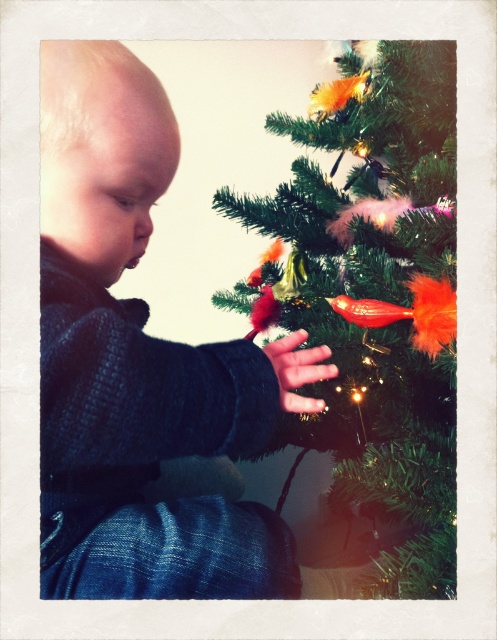
You are a photographer setting up a shot of the dark blue knitted sweater at left and the green matte christmas tree at center. Which object should you focus on first if you want to capture both in sharp focus?

The dark blue knitted sweater at left is closer to the viewer than the green matte christmas tree at center, so you should focus on the dark blue knitted sweater at left first to ensure both are in focus.

You are standing in front of the Christmas tree and want to place a small gift. You have two points to choose from on the tree where you can place the gift. The first point is at coordinate point (94, 364) and the second point is at coordinate point (382, 417). Which point is closer to you where you can place the gift?

Point (94, 364) is closer to the viewer than point (382, 417), so you should place the gift at point (94, 364).

You are a photographer setting up a wide shot of the scene. You want to ensure both the dark blue knitted sweater at left and the green matte christmas tree at center are fully visible. Which object requires more space in the frame to accommodate its width?

The green matte christmas tree at center requires more space in the frame because it has a greater width compared to the dark blue knitted sweater at left.